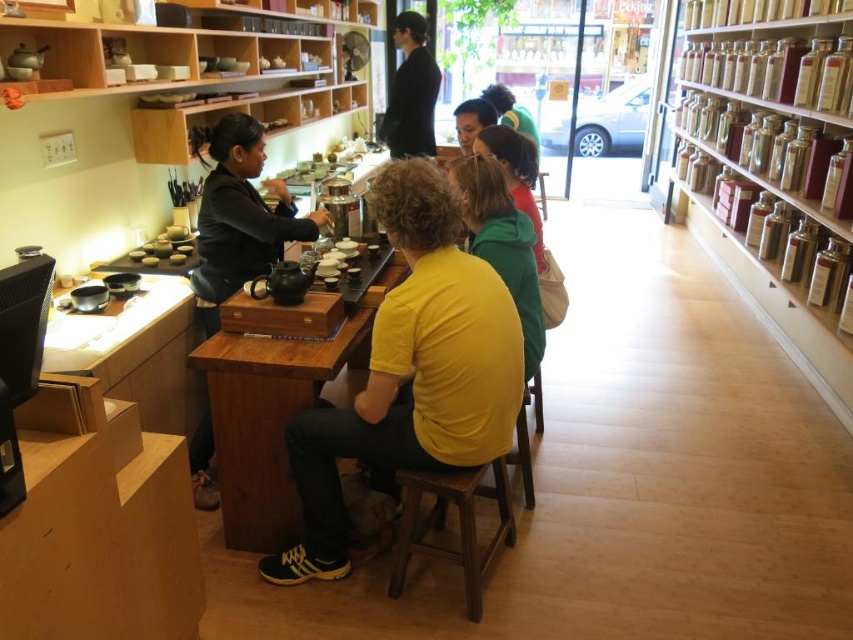
Question: Which object appears closest to the camera in this image?

Choices:
 (A) yellow matte shirt at center
 (B) matte black hair at center
 (C) wooden table at center
 (D) matte black teapot at center

Answer: (A)

Question: Which point is farther to the camera?

Choices:
 (A) matte black hair at center
 (B) green matte hoodie at center
 (C) yellow matte shirt at center

Answer: (A)

Question: Can you confirm if wooden table at center is positioned below green matte hoodie at center?

Choices:
 (A) no
 (B) yes

Answer: (B)

Question: Is yellow matte shirt at center further to camera compared to green matte hoodie at center?

Choices:
 (A) no
 (B) yes

Answer: (A)

Question: Which of the following is the closest to the observer?

Choices:
 (A) green matte hoodie at center
 (B) yellow matte shirt at center
 (C) brown wooden stool at lower center
 (D) matte black hair at center

Answer: (B)

Question: In this image, where is wooden table at center located relative to brown wooden stool at lower center?

Choices:
 (A) above
 (B) below

Answer: (A)